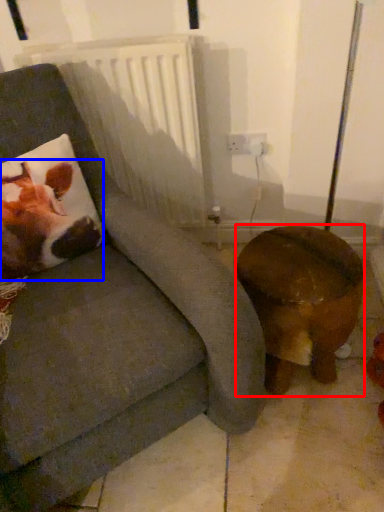
Question: Which point is further to the camera, furniture (highlighted by a red box) or animal (highlighted by a blue box)?

Choices:
 (A) furniture
 (B) animal

Answer: (B)